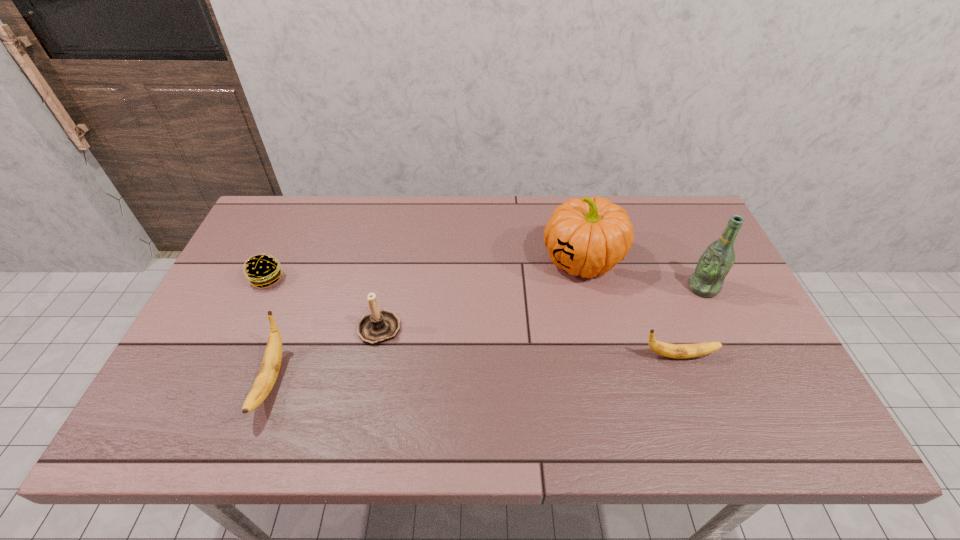
Find the location of a particular element. Image resolution: width=960 pixels, height=540 pixels. object that is at the left edge is located at coordinates (262, 270).

Identify the location of banana at the right edge. This screenshot has height=540, width=960. (680, 351).

Identify the location of beer bottle present at the right edge. Image resolution: width=960 pixels, height=540 pixels. (714, 264).

The height and width of the screenshot is (540, 960). I want to click on vacant space at the far edge, so click(x=489, y=210).

Where is `free spot at the near edge of the desktop`? The width and height of the screenshot is (960, 540). free spot at the near edge of the desktop is located at coordinates (423, 377).

In the image, there is a desktop. At what (x,y) coordinates should I click in order to perform the action: click on vacant space at the right edge. Please return your answer as a coordinate pair (x, y). Looking at the image, I should click on (756, 367).

In the image, there is a desktop. Where is `vacant space at the far right corner`? This screenshot has height=540, width=960. vacant space at the far right corner is located at coordinates (709, 235).

In the image, there is a desktop. Identify the location of vacant region at the near right corner. Image resolution: width=960 pixels, height=540 pixels. click(x=722, y=375).

At what (x,y) coordinates should I click in order to perform the action: click on vacant area that lies between the shortest object and the third object from left to right. Please return your answer as a coordinate pair (x, y). Image resolution: width=960 pixels, height=540 pixels. Looking at the image, I should click on (324, 302).

At what (x,y) coordinates should I click in order to perform the action: click on empty space between the taller banana and the pumpkin. Please return your answer as a coordinate pair (x, y). This screenshot has height=540, width=960. Looking at the image, I should click on (426, 320).